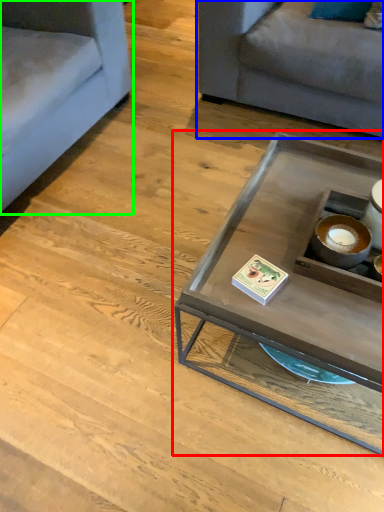
Question: Estimate the real-world distances between objects in this image. Which object is farther from coffee table (highlighted by a red box), studio couch (highlighted by a blue box) or studio couch (highlighted by a green box)?

Choices:
 (A) studio couch
 (B) studio couch

Answer: (B)